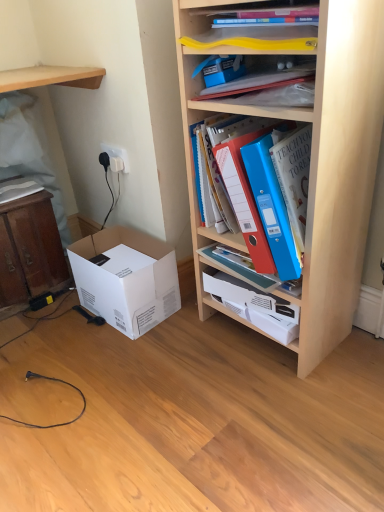
Question: Does blue plastic binder at upper center, the third book in the left-to-right sequence, come behind blue plastic folders at center?

Choices:
 (A) no
 (B) yes

Answer: (A)

Question: Is blue plastic binder at upper center, which is counted as the 1th book, starting from the right, aimed at blue plastic folders at center?

Choices:
 (A) yes
 (B) no

Answer: (B)

Question: Considering the relative positions of blue plastic binder at upper center, which is counted as the 1th book, starting from the right, and blue plastic folders at center in the image provided, is blue plastic binder at upper center, which is counted as the 1th book, starting from the right, to the right of blue plastic folders at center from the viewer's perspective?

Choices:
 (A) yes
 (B) no

Answer: (B)

Question: Does blue plastic binder at upper center, the third book in the left-to-right sequence, have a smaller size compared to blue plastic folders at center?

Choices:
 (A) no
 (B) yes

Answer: (A)

Question: Is blue plastic binder at upper center, which is counted as the 1th book, starting from the right, at the left side of blue plastic folders at center?

Choices:
 (A) no
 (B) yes

Answer: (B)

Question: Is blue plastic binder at upper center, which is counted as the 1th book, starting from the right, oriented away from blue plastic folders at center?

Choices:
 (A) yes
 (B) no

Answer: (B)

Question: From the image's perspective, is blue plastic binder at upper center, the third book in the left-to-right sequence, located beneath wooden cabinet at left?

Choices:
 (A) yes
 (B) no

Answer: (B)

Question: From a real-world perspective, is blue plastic binder at upper center, which is counted as the 1th book, starting from the right, positioned under wooden cabinet at left based on gravity?

Choices:
 (A) yes
 (B) no

Answer: (B)

Question: Is blue plastic binder at upper center, which is counted as the 1th book, starting from the right, thinner than wooden cabinet at left?

Choices:
 (A) yes
 (B) no

Answer: (B)

Question: Does blue plastic binder at upper center, the third book in the left-to-right sequence, have a smaller size compared to wooden cabinet at left?

Choices:
 (A) no
 (B) yes

Answer: (B)

Question: Is the position of blue plastic binder at upper center, the third book in the left-to-right sequence, less distant than that of wooden cabinet at left?

Choices:
 (A) yes
 (B) no

Answer: (A)

Question: Is the surface of blue plastic binder at upper center, the third book in the left-to-right sequence, in direct contact with wooden cabinet at left?

Choices:
 (A) yes
 (B) no

Answer: (B)

Question: Is wooden shelf at upper left, arranged as the 2th shelf when viewed from the right, at the back of blue plastic binder at upper center, the third book in the left-to-right sequence?

Choices:
 (A) no
 (B) yes

Answer: (A)